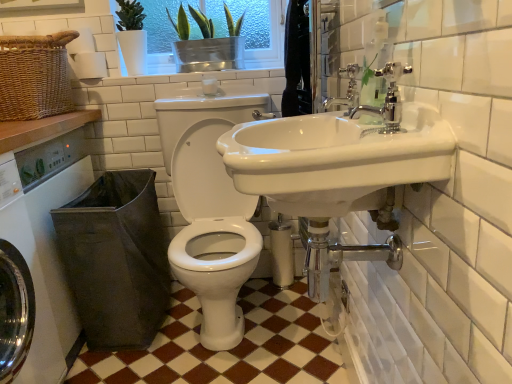
In order to click on vacant location below white glossy toilet at center (from a real-world perspective) in this screenshot , I will do `click(239, 334)`.